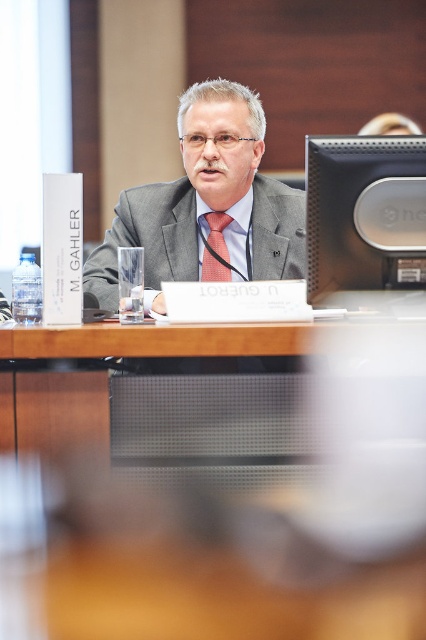
In order to click on matte gray suit at center in this screenshot , I will do `click(206, 204)`.

What do you see at coordinates (206, 204) in the screenshot?
I see `matte gray suit at center` at bounding box center [206, 204].

Which is behind, point (264, 212) or point (412, 173)?

The point (264, 212) is more distant.

This screenshot has width=426, height=640. Identify the location of matte gray suit at center. (206, 204).

From the picture: Is sleek black monitor at upper center wider than orange checkered tie at center?

Yes, sleek black monitor at upper center is wider than orange checkered tie at center.

Which is in front, point (336, 276) or point (221, 248)?

Point (336, 276) is more forward.

Where is `sleek black monitor at upper center`? The width and height of the screenshot is (426, 640). sleek black monitor at upper center is located at coordinates (365, 212).

Does point (106, 291) lie behind point (224, 225)?

No, it is in front of (224, 225).

Does point (242, 104) come in front of point (218, 278)?

Yes, it is.

Measure the distance between point (253,122) and camera.

Point (253,122) and camera are 2.17 meters apart from each other.

Find the location of a particular element. matte gray suit at center is located at coordinates (206, 204).